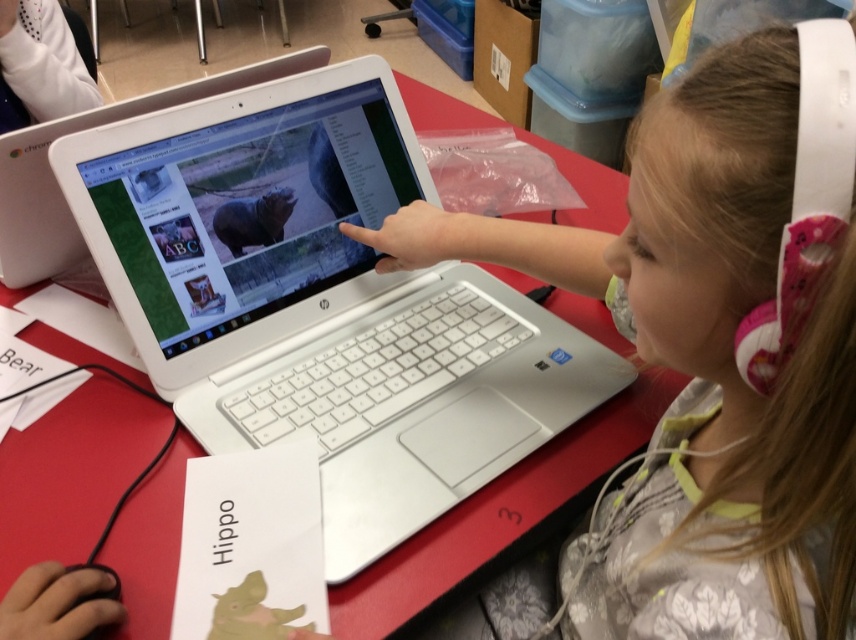
Question: Based on their relative distances, which object is farther from the white plastic laptop at center?

Choices:
 (A) white plastic headphones at upper right
 (B) white plastic laptop at upper center

Answer: (B)

Question: Observing the image, what is the correct spatial positioning of white plastic laptop at center in reference to white plastic headphones at upper right?

Choices:
 (A) left
 (B) right

Answer: (A)

Question: Where is white plastic headphones at upper right located in relation to white plastic laptop at upper center in the image?

Choices:
 (A) above
 (B) below

Answer: (B)

Question: Can you confirm if white plastic laptop at center is bigger than white plastic headphones at upper right?

Choices:
 (A) yes
 (B) no

Answer: (A)

Question: Estimate the real-world distances between objects in this image. Which object is closer to the white plastic headphones at upper right?

Choices:
 (A) white plastic laptop at upper center
 (B) white plastic laptop at center

Answer: (B)

Question: Which point is farther to the camera?

Choices:
 (A) (254, 404)
 (B) (809, 364)
 (C) (45, 228)

Answer: (C)